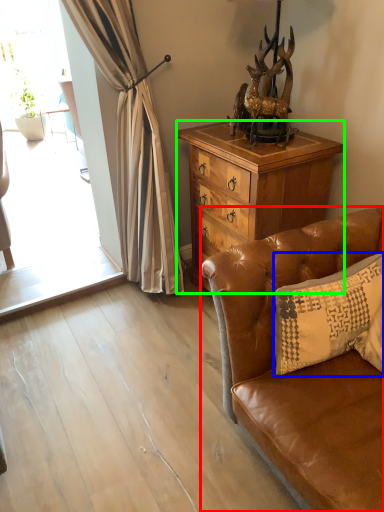
Question: Considering the real-world distances, which object is closest to studio couch (highlighted by a red box)? pillow (highlighted by a blue box) or cabinetry (highlighted by a green box).

Choices:
 (A) pillow
 (B) cabinetry

Answer: (A)